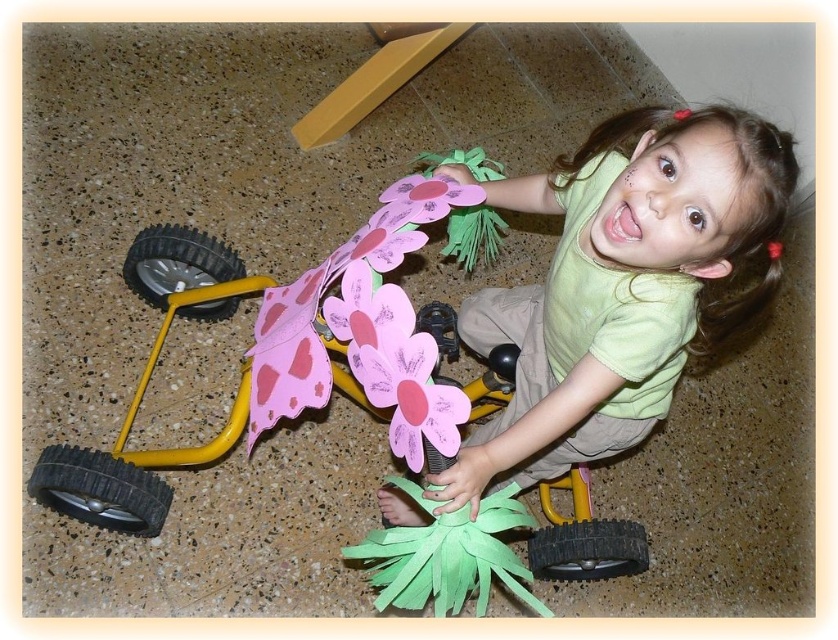
Question: Does green matte shirt at upper center appear over yellow plastic toy car at lower left?

Choices:
 (A) yes
 (B) no

Answer: (B)

Question: From the image, what is the correct spatial relationship of green matte shirt at upper center in relation to yellow plastic toy car at lower left?

Choices:
 (A) right
 (B) left

Answer: (A)

Question: Among these objects, which one is farthest from the camera?

Choices:
 (A) green matte shirt at upper center
 (B) yellow plastic toy car at lower left

Answer: (B)

Question: Does green matte shirt at upper center come in front of yellow plastic toy car at lower left?

Choices:
 (A) no
 (B) yes

Answer: (B)

Question: Which of the following is the closest to the observer?

Choices:
 (A) yellow plastic toy car at lower left
 (B) green matte shirt at upper center

Answer: (B)